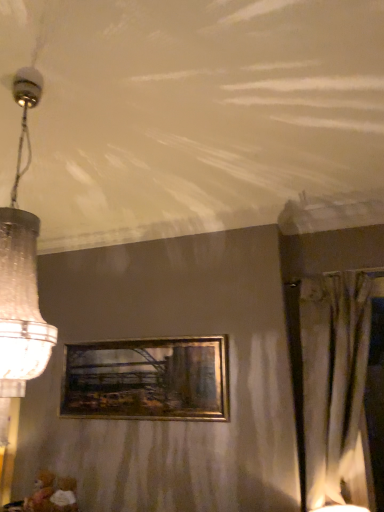
Question: From their relative heights in the image, would you say silky beige curtain at right is taller or shorter than clear glass chandelier at left?

Choices:
 (A) short
 (B) tall

Answer: (B)

Question: In terms of size, does silky beige curtain at right appear bigger or smaller than clear glass chandelier at left?

Choices:
 (A) small
 (B) big

Answer: (A)

Question: Based on their relative distances, which object is farther from the silky beige curtain at right?

Choices:
 (A) gold metallic picture frame at center
 (B) clear glass chandelier at left

Answer: (B)

Question: Based on their relative distances, which object is nearer to the silky beige curtain at right?

Choices:
 (A) gold metallic picture frame at center
 (B) clear glass chandelier at left

Answer: (A)